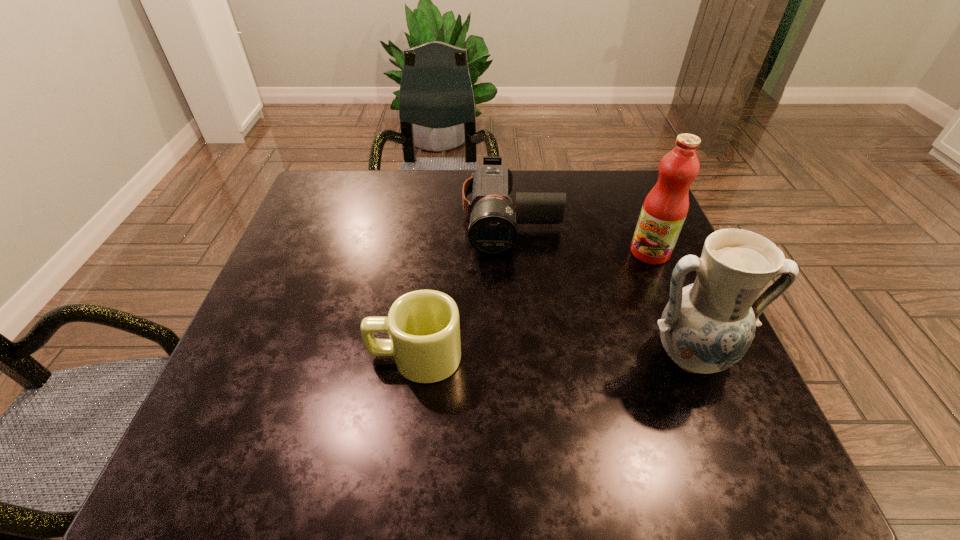
Where is `free space between the mug and the camcorder`? Image resolution: width=960 pixels, height=540 pixels. free space between the mug and the camcorder is located at coordinates (463, 287).

Locate an element on the screen. The height and width of the screenshot is (540, 960). free space between the pottery and the mug is located at coordinates (552, 356).

You are a GUI agent. You are given a task and a screenshot of the screen. Output one action in this format:
    pyautogui.click(x=<x>, y=<y>)
    Task: Click on the blank region between the mug and the camcorder
    Image resolution: width=960 pixels, height=540 pixels.
    Given the screenshot: What is the action you would take?
    pyautogui.click(x=463, y=287)

Identify which object is the third closest to the fruit juice. Please provide its 2D coordinates. Your answer should be formatted as a tuple, i.e. [(x, y)], where the tuple contains the x and y coordinates of a point satisfying the conditions above.

[(424, 328)]

Identify which object is the second nearest to the fruit juice. Please provide its 2D coordinates. Your answer should be formatted as a tuple, i.e. [(x, y)], where the tuple contains the x and y coordinates of a point satisfying the conditions above.

[(706, 327)]